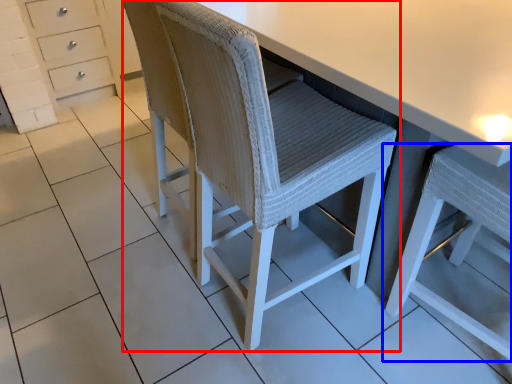
Question: Which object appears closest to the camera in this image, chair (highlighted by a red box) or chair (highlighted by a blue box)?

Choices:
 (A) chair
 (B) chair

Answer: (B)